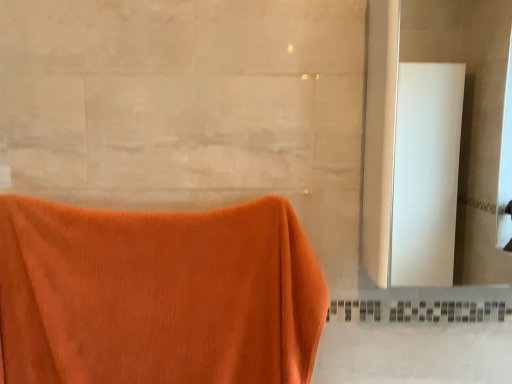
Question: Should I look upward or downward to see white glossy mirror at right?

Choices:
 (A) up
 (B) down

Answer: (A)